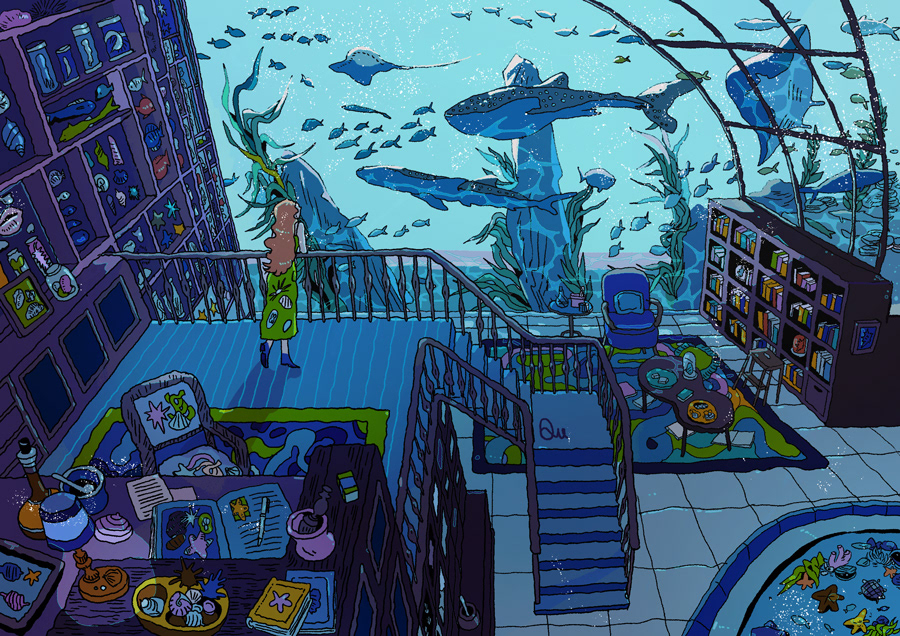
In order to click on display wall in this screenshot , I will do `click(86, 159)`, `click(218, 245)`, `click(21, 20)`, `click(3, 168)`.